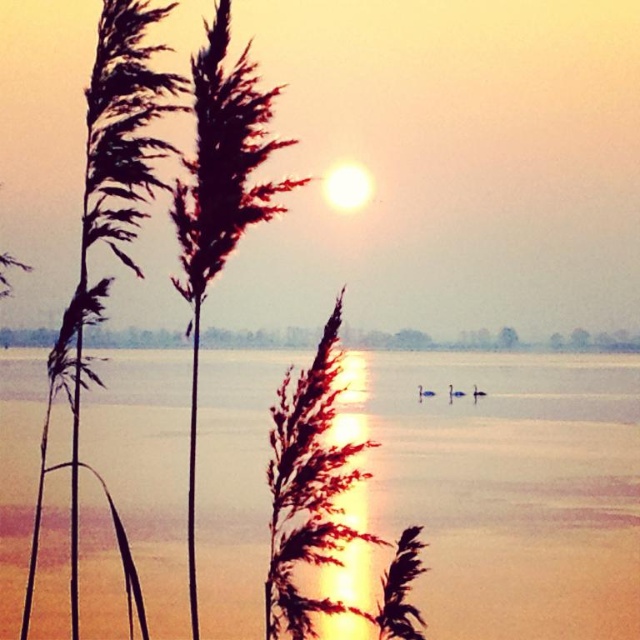
You are a bird flying over the sunset scene. You need to land on either the brown fuzzy reed at left or the smooth water at center. Which surface would allow you to land safely without sinking?

The brown fuzzy reed at left is taller than smooth water at center, so landing on the smooth water at center might cause you to sink since it is lower. The reed is taller and solid, making it a safer landing spot.

You are observing the sunset scene and notice two points marked in the image. Which point is closer to you, point (259, 109) or point (461, 344)?

Point (259, 109) is closer to the viewer than point (461, 344).

You are standing at the origin point of the coordinate system in the scene. You want to walk to the transparent water at center. What direction should you move in to reach it?

The transparent water at center is located at coordinate point (506, 486). Since you are at the origin, you should move in the direction of increasing both x and y coordinates to reach it.